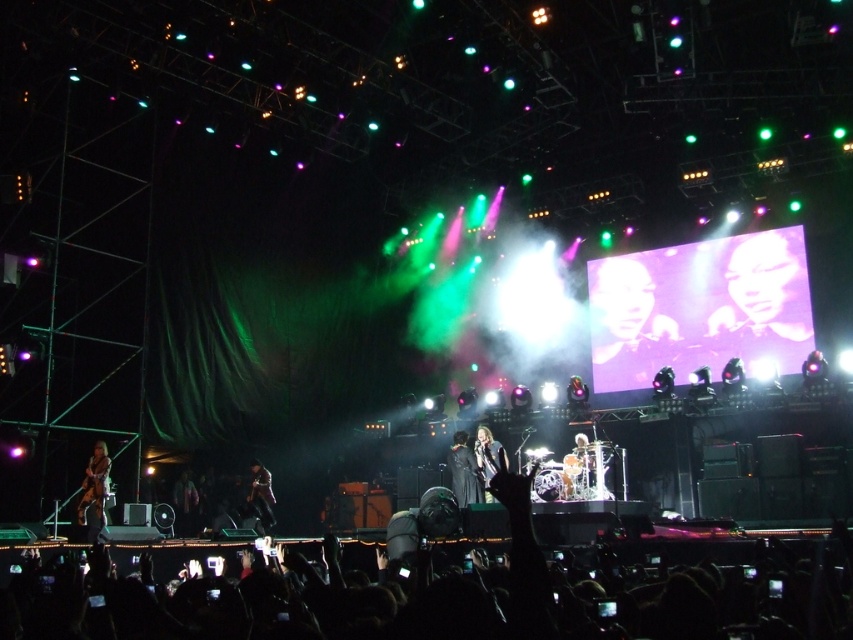
Is black leather jacket at center to the right of dark gray fabric jacket at center from the viewer's perspective?

Indeed, black leather jacket at center is positioned on the right side of dark gray fabric jacket at center.

You are a GUI agent. You are given a task and a screenshot of the screen. Output one action in this format:
    pyautogui.click(x=<x>, y=<y>)
    Task: Click on the black leather jacket at center
    
    Given the screenshot: What is the action you would take?
    pyautogui.click(x=463, y=472)

Is point (451, 465) positioned before point (268, 493)?

Yes.

Locate an element on the screen. This screenshot has height=640, width=853. black leather jacket at center is located at coordinates (463, 472).

Is point (785, 317) in front of point (178, 492)?

No, it is not.

Looking at this image, is smooth skin face at upper right to the left of dark fabric jacket at lower left from the viewer's perspective?

In fact, smooth skin face at upper right is to the right of dark fabric jacket at lower left.

What do you see at coordinates (766, 285) in the screenshot? This screenshot has height=640, width=853. I see `smooth skin face at upper right` at bounding box center [766, 285].

The image size is (853, 640). Find the location of `smooth skin face at upper right`. smooth skin face at upper right is located at coordinates (766, 285).

Is shiny silver drum set at center thinner than black leather jacket at center?

Incorrect, shiny silver drum set at center's width is not less than black leather jacket at center's.

Is shiny silver drum set at center above black leather jacket at center?

Incorrect, shiny silver drum set at center is not positioned above black leather jacket at center.

Find the location of a particular element. This screenshot has height=640, width=853. shiny silver drum set at center is located at coordinates (584, 470).

I want to click on shiny silver drum set at center, so click(584, 470).